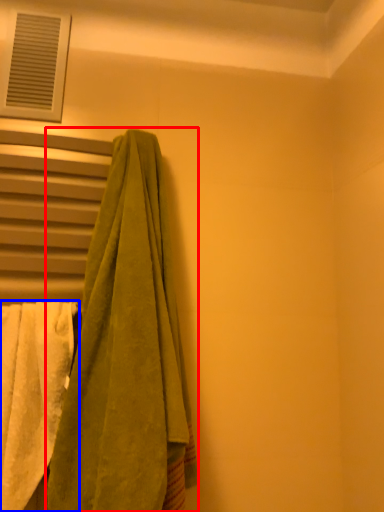
Question: Which of the following is the closest to the observer, towel (highlighted by a red box) or towel (highlighted by a blue box)?

Choices:
 (A) towel
 (B) towel

Answer: (A)